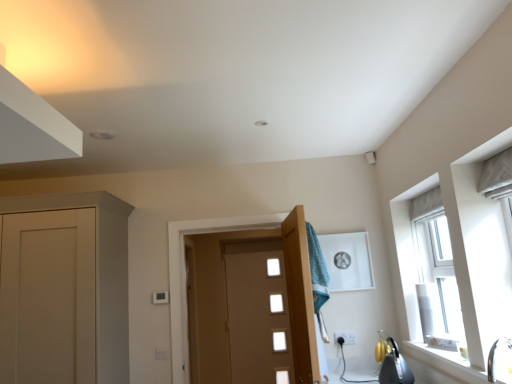
Question: Is teal fabric towel at center outside matte brown door at center, the second door when ordered from front to back?

Choices:
 (A) yes
 (B) no

Answer: (A)

Question: Are teal fabric towel at center and matte brown door at center, the second door when ordered from front to back, making contact?

Choices:
 (A) yes
 (B) no

Answer: (B)

Question: Is teal fabric towel at center thinner than matte brown door at center, the second door when ordered from front to back?

Choices:
 (A) yes
 (B) no

Answer: (B)

Question: From the image's perspective, is teal fabric towel at center located beneath matte brown door at center, the second door when ordered from front to back?

Choices:
 (A) no
 (B) yes

Answer: (A)

Question: Is teal fabric towel at center smaller than matte brown door at center, arranged as the first door when viewed from the back?

Choices:
 (A) yes
 (B) no

Answer: (A)

Question: From a real-world perspective, is wooden door at center, the second door from the back, above or below matte brown door at center, arranged as the first door when viewed from the back?

Choices:
 (A) below
 (B) above

Answer: (B)

Question: Based on their sizes in the image, would you say wooden door at center, positioned as the first door in front-to-back order, is bigger or smaller than matte brown door at center, arranged as the first door when viewed from the back?

Choices:
 (A) big
 (B) small

Answer: (B)

Question: In the image, is wooden door at center, the second door from the back, on the left side or the right side of matte brown door at center, the second door when ordered from front to back?

Choices:
 (A) left
 (B) right

Answer: (B)

Question: From their relative heights in the image, would you say wooden door at center, the second door from the back, is taller or shorter than matte brown door at center, arranged as the first door when viewed from the back?

Choices:
 (A) short
 (B) tall

Answer: (A)

Question: Considering the positions of white plastic electric outlet at lower center and wooden door at center, positioned as the first door in front-to-back order, in the image, is white plastic electric outlet at lower center wider or thinner than wooden door at center, positioned as the first door in front-to-back order,?

Choices:
 (A) thin
 (B) wide

Answer: (A)

Question: Considering the positions of white plastic electric outlet at lower center and wooden door at center, positioned as the first door in front-to-back order, in the image, is white plastic electric outlet at lower center taller or shorter than wooden door at center, positioned as the first door in front-to-back order,?

Choices:
 (A) short
 (B) tall

Answer: (A)

Question: Is point (345, 337) positioned closer to the camera than point (314, 365)?

Choices:
 (A) farther
 (B) closer

Answer: (A)

Question: Relative to wooden door at center, positioned as the first door in front-to-back order, is white plastic electric outlet at lower center in front or behind?

Choices:
 (A) behind
 (B) front

Answer: (A)

Question: From a real-world perspective, relative to metallic silver kettle at lower right, is teal fabric towel at center vertically above or below?

Choices:
 (A) above
 (B) below

Answer: (A)

Question: Is teal fabric towel at center taller or shorter than metallic silver kettle at lower right?

Choices:
 (A) tall
 (B) short

Answer: (A)